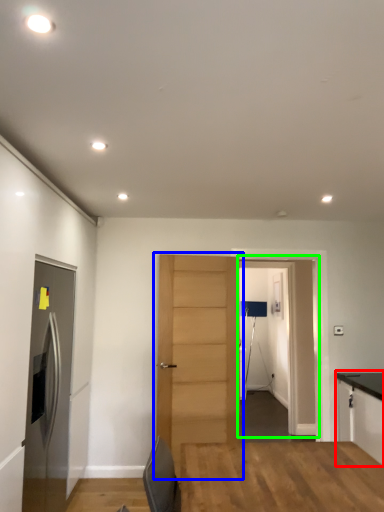
Question: Which object is positioned closest to cabinetry (highlighted by a red box)? Select from door (highlighted by a blue box) and glass door (highlighted by a green box).

Choices:
 (A) door
 (B) glass door

Answer: (A)